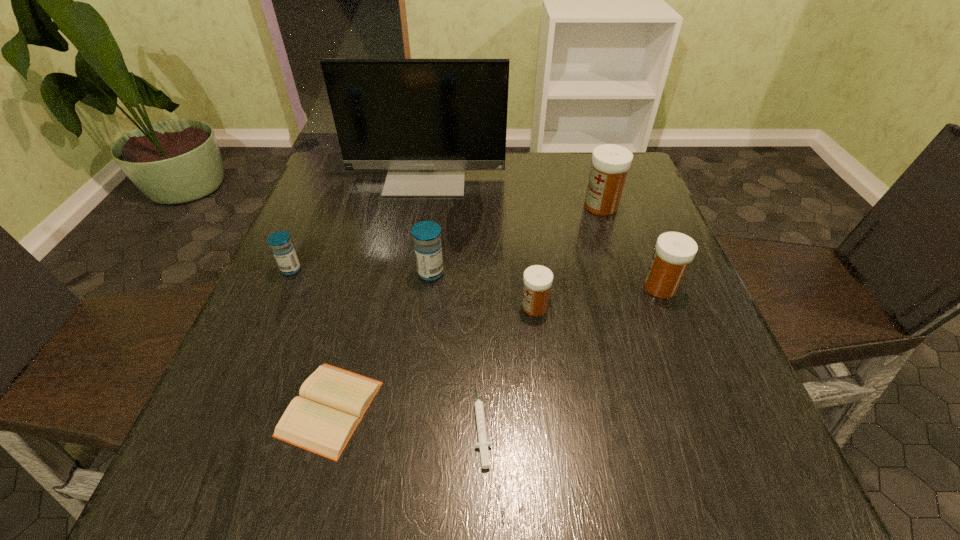
This screenshot has width=960, height=540. I want to click on the seventh tallest object, so click(332, 402).

You are a GUI agent. You are given a task and a screenshot of the screen. Output one action in this format:
    pyautogui.click(x=<x>, y=<y>)
    Task: Click on the white syringe
    The image size is (960, 540).
    Given the screenshot: What is the action you would take?
    pyautogui.click(x=483, y=444)

This screenshot has height=540, width=960. What are the coordinates of `syringe` in the screenshot? It's located at (483, 444).

Image resolution: width=960 pixels, height=540 pixels. Find the location of `free space located on the screen of the tallest object`. free space located on the screen of the tallest object is located at coordinates (421, 208).

Identify the location of free space located 0.130m on the front of the farthest medicine. Image resolution: width=960 pixels, height=540 pixels. (616, 252).

This screenshot has height=540, width=960. I want to click on vacant area situated 0.050m on the front of the bigger blue medicine, so click(x=428, y=300).

In order to click on vacant space situated on the front of the second biggest white medicine in this screenshot , I will do `click(684, 348)`.

The width and height of the screenshot is (960, 540). In order to click on vacant region located on the front of the leftmost object in this screenshot , I will do `click(271, 315)`.

Locate an element on the screen. The image size is (960, 540). free space located 0.310m on the left of the smallest white medicine is located at coordinates (367, 307).

The height and width of the screenshot is (540, 960). Find the location of `vacant space located 0.050m on the right of the seventh tallest object`. vacant space located 0.050m on the right of the seventh tallest object is located at coordinates (409, 408).